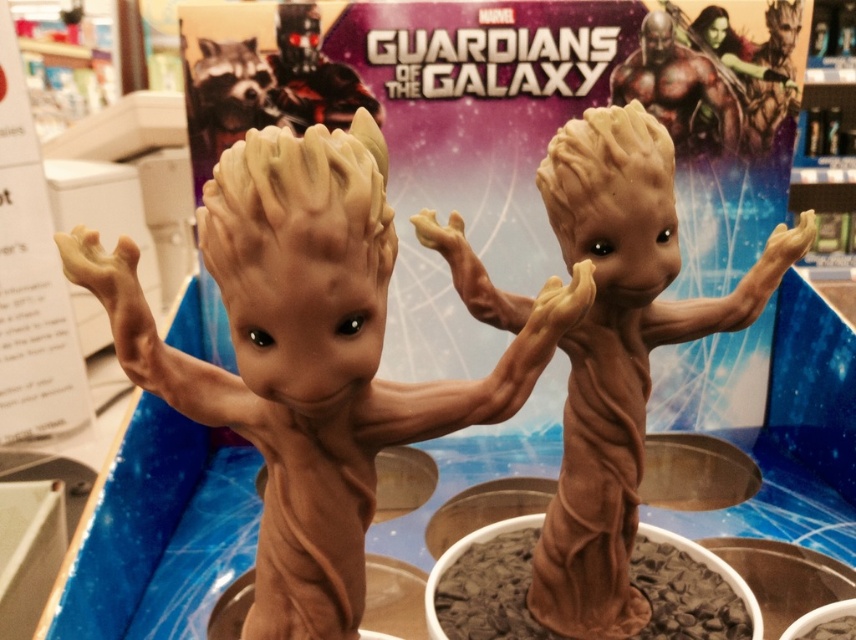
Question: Does brown rubbery tree-like figure at center appear on the right side of brown rubber groot at upper right?

Choices:
 (A) no
 (B) yes

Answer: (A)

Question: Does brown rubbery tree-like figure at center appear on the right side of shiny metallic raccoon at upper left?

Choices:
 (A) yes
 (B) no

Answer: (A)

Question: Which is nearer to the brown rubber groot at upper right?

Choices:
 (A) shiny metallic raccoon at upper left
 (B) matte black figure at upper center
 (C) brown rubbery tree at center
 (D) brown rubbery tree-like figure at center

Answer: (B)

Question: Which object is farther from the camera taking this photo?

Choices:
 (A) shiny metallic raccoon at upper left
 (B) matte black figure at upper center
 (C) brown rubbery tree-like figure at center

Answer: (A)

Question: Which point is farther to the camera?

Choices:
 (A) (706, 100)
 (B) (312, 76)
 (C) (223, 54)
 (D) (336, 244)

Answer: (A)

Question: Can you confirm if brown rubbery tree at center is positioned to the right of brown rubber groot at upper right?

Choices:
 (A) no
 (B) yes

Answer: (A)